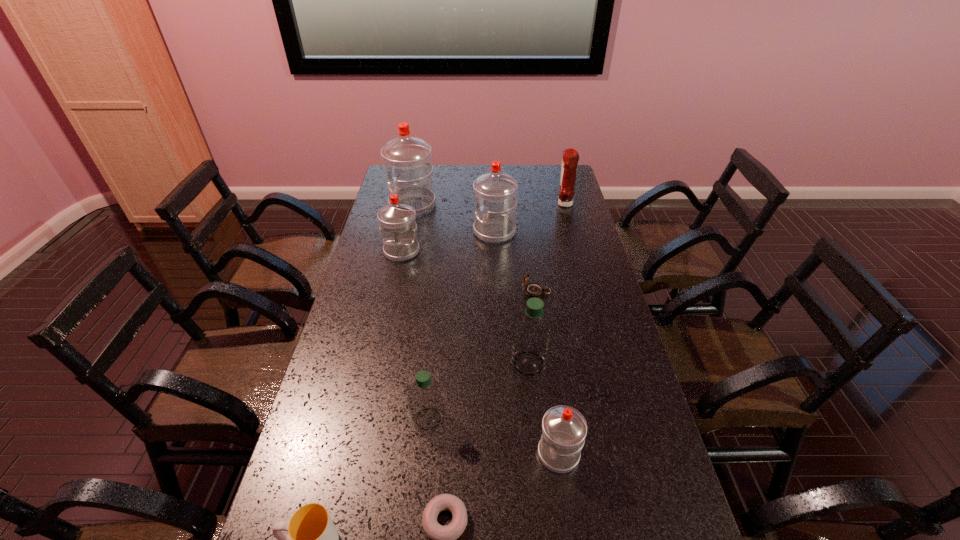
Where is `the smaller green water bottle`? The width and height of the screenshot is (960, 540). the smaller green water bottle is located at coordinates (425, 398).

Where is `the nearest white water bottle`? The height and width of the screenshot is (540, 960). the nearest white water bottle is located at coordinates (564, 429).

The image size is (960, 540). Find the location of `compass`. compass is located at coordinates (534, 289).

In order to click on free space located 0.210m on the handle side of the second tallest water bottle in this screenshot , I will do `click(420, 232)`.

Identify the location of vacant space situated on the handle side of the second tallest water bottle. This screenshot has width=960, height=540. (423, 232).

Identify the location of free space located 0.320m on the handle side of the second tallest water bottle. This screenshot has width=960, height=540. (393, 232).

The image size is (960, 540). I want to click on vacant space located 0.050m on the left of the rightmost object, so click(544, 204).

I want to click on blank area located 0.100m on the handle side of the second smallest white water bottle, so pos(396,281).

This screenshot has width=960, height=540. In order to click on vacant space located on the front of the right green water bottle in this screenshot , I will do `click(535, 427)`.

At what (x,y) coordinates should I click in order to perform the action: click on vacant position located 0.060m on the left of the third water bottle from left to right. Please return your answer as a coordinate pair (x, y). Looking at the image, I should click on (388, 419).